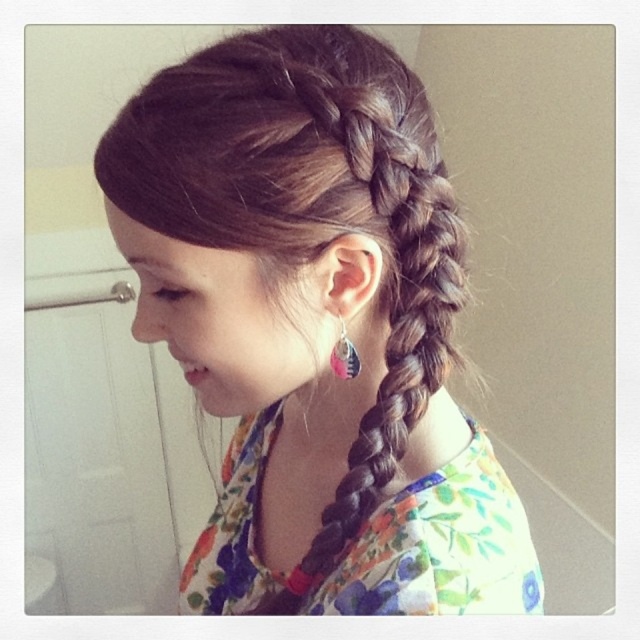
Based on the coordinates provided in the image, where is the dark brown hair at center located?

The dark brown hair at center is located at the 2D coordinates point (316, 326).

In the scene shown: The young girl has dark brown hair at center and a pink fabric earring at ear. Which object is wider?

The dark brown hair at center is wider than the pink fabric earring at ear.